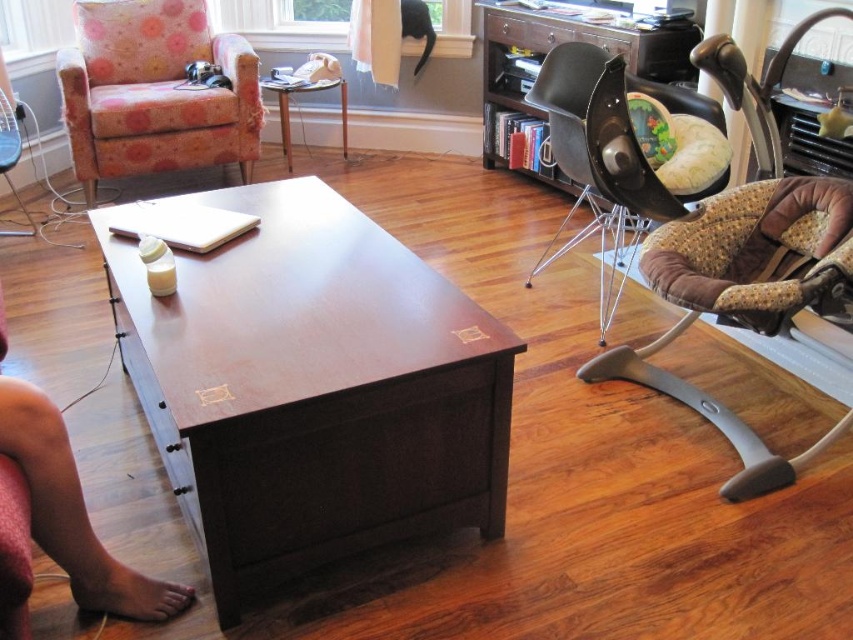
Question: Is floral fabric swivel chair at left positioned in front of wooden table at center?

Choices:
 (A) no
 (B) yes

Answer: (B)

Question: Which object is the closest to the wooden table at center?

Choices:
 (A) floral fabric swivel chair at left
 (B) dark brown wood table at center

Answer: (A)

Question: Does dark brown wood table at center have a larger size compared to wooden table at center?

Choices:
 (A) no
 (B) yes

Answer: (B)

Question: Which of these objects is positioned closest to the floral fabric swivel chair at left?

Choices:
 (A) dark brown wood table at center
 (B) wooden table at center

Answer: (B)

Question: Which object appears farthest from the camera in this image?

Choices:
 (A) floral fabric swivel chair at left
 (B) wooden table at center

Answer: (B)

Question: Does dark brown wood table at center have a smaller size compared to floral fabric swivel chair at left?

Choices:
 (A) no
 (B) yes

Answer: (A)